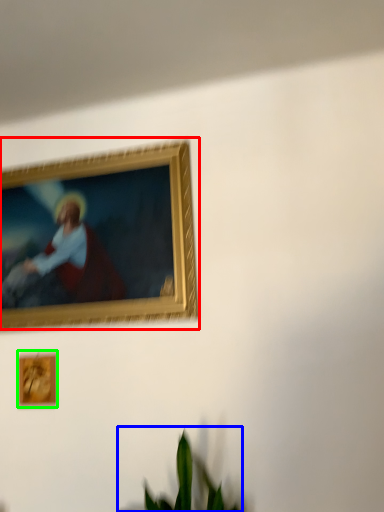
Question: Based on their relative distances, which object is nearer to picture frame (highlighted by a red box)? Choose from houseplant (highlighted by a blue box) and picture frame (highlighted by a green box).

Choices:
 (A) houseplant
 (B) picture frame

Answer: (B)